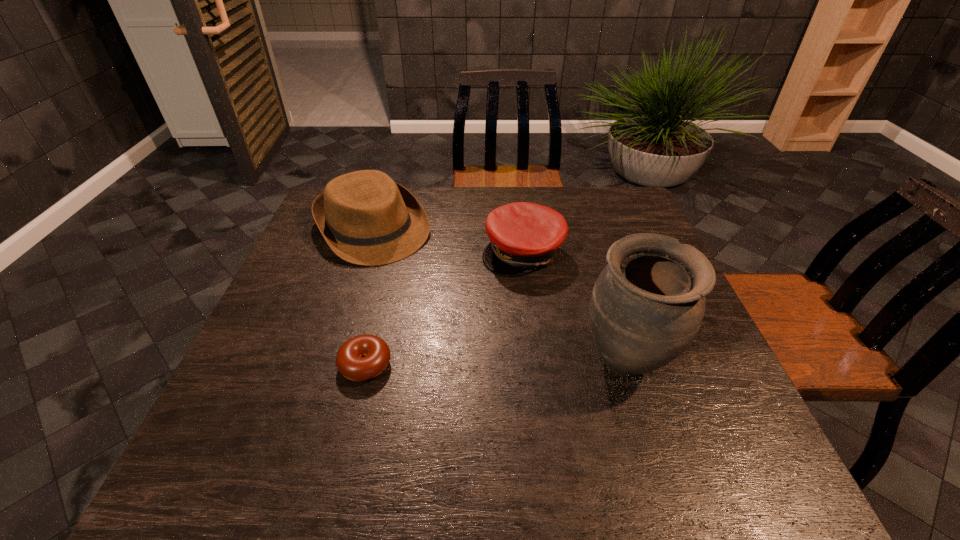
In the image, there is a desktop. At what (x,y) coordinates should I click in order to perform the action: click on free space at the left edge. Please return your answer as a coordinate pair (x, y). Looking at the image, I should click on (317, 303).

In the image, there is a desktop. Where is `vacant space at the far right corner`? vacant space at the far right corner is located at coordinates (598, 223).

Find the location of a particular element. The image size is (960, 540). free space at the near right corner of the desktop is located at coordinates (686, 428).

You are a GUI agent. You are given a task and a screenshot of the screen. Output one action in this format:
    pyautogui.click(x=<x>, y=<y>)
    Task: Click on the free space between the shortest object and the third tallest object
    The width and height of the screenshot is (960, 540).
    Given the screenshot: What is the action you would take?
    pyautogui.click(x=444, y=308)

What are the coordinates of `free point between the shortest object and the urn` in the screenshot? It's located at (495, 364).

The width and height of the screenshot is (960, 540). Identify the location of vacant area that lies between the shortest object and the third shortest object. (369, 296).

Locate an element on the screen. This screenshot has height=540, width=960. blank region between the cap and the urn is located at coordinates (574, 308).

Identify the location of free spot between the shortest object and the third shortest object. The image size is (960, 540). (369, 296).

Locate an element on the screen. free spot between the fedora and the doughnut is located at coordinates (369, 296).

This screenshot has height=540, width=960. I want to click on free spot between the cap and the second tallest object, so click(x=447, y=240).